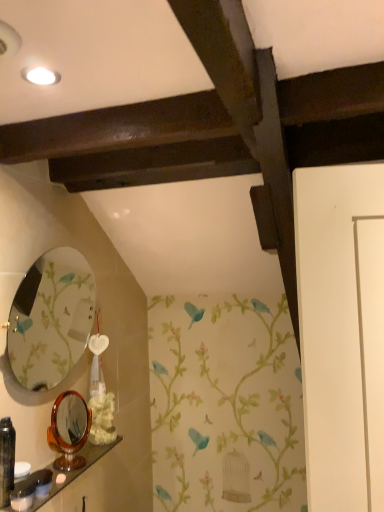
Question: Is matte black toiletry at lower left, placed as the third toiletry when sorted from left to right, bigger or smaller than black plastic bottle at lower left, the 1th toiletry from the left?

Choices:
 (A) small
 (B) big

Answer: (A)

Question: In terms of width, does matte black toiletry at lower left, the first toiletry when ordered from right to left, look wider or thinner when compared to black plastic bottle at lower left, the 1th toiletry from the left?

Choices:
 (A) wide
 (B) thin

Answer: (B)

Question: Estimate the real-world distances between objects in this image. Which object is closer to the wooden polished shelf at lower left?

Choices:
 (A) matte glass mirror at left, which is the 2th mirror in bottom-to-top order
 (B) white matte flower at lower center
 (C) black plastic bottle at lower left, the 1th toiletry from the left
 (D) tortoiseshell mirror at lower left, the 2th mirror from the top
 (E) matte black toiletry at lower left, placed as the third toiletry when sorted from left to right

Answer: (E)

Question: Considering the real-world distances, which object is farthest from the matte glass mirror at left, which ranks as the 1th mirror in top-to-bottom order?

Choices:
 (A) tortoiseshell mirror at lower left, the 2th mirror from the top
 (B) white matte flower at lower center
 (C) white glossy soap at lower left, acting as the second toiletry starting from the left
 (D) wooden polished shelf at lower left
 (E) black plastic bottle at lower left, the 1th toiletry from the left

Answer: (C)